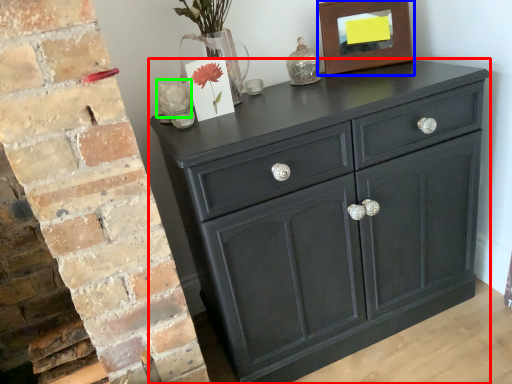
Question: Estimate the real-world distances between objects in this image. Which object is farther from chest of drawers (highlighted by a red box), picture frame (highlighted by a blue box) or flower (highlighted by a green box)?

Choices:
 (A) picture frame
 (B) flower

Answer: (B)